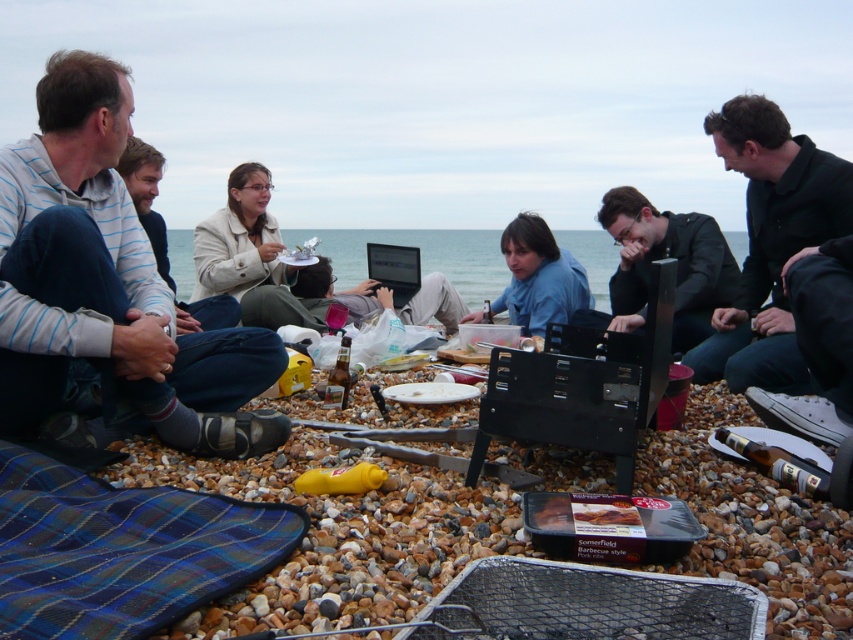
Does black matte jacket at right have a lesser width compared to light beige jacket at center?

Indeed, black matte jacket at right has a lesser width compared to light beige jacket at center.

Is black matte jacket at right above light beige jacket at center?

No, black matte jacket at right is not above light beige jacket at center.

Which is behind, point (809, 150) or point (136, 164)?

The point (136, 164) is behind.

What are the coordinates of `black matte jacket at right` in the screenshot? It's located at (769, 243).

Does point (764, 381) come in front of point (637, 204)?

Yes, point (764, 381) is closer to viewer.

Is black matte jacket at right to the right of black matte jacket at center from the viewer's perspective?

Correct, you'll find black matte jacket at right to the right of black matte jacket at center.

Is point (729, 387) closer to camera compared to point (706, 337)?

Yes, point (729, 387) is closer to viewer.

I want to click on black matte jacket at right, so click(x=769, y=243).

Does black matte jacket at center have a lesser height compared to light beige jacket at center?

Yes, black matte jacket at center is shorter than light beige jacket at center.

The image size is (853, 640). What do you see at coordinates (660, 259) in the screenshot?
I see `black matte jacket at center` at bounding box center [660, 259].

At what (x,y) coordinates should I click in order to perform the action: click on black matte jacket at center. Please return your answer as a coordinate pair (x, y). This screenshot has width=853, height=640. Looking at the image, I should click on (660, 259).